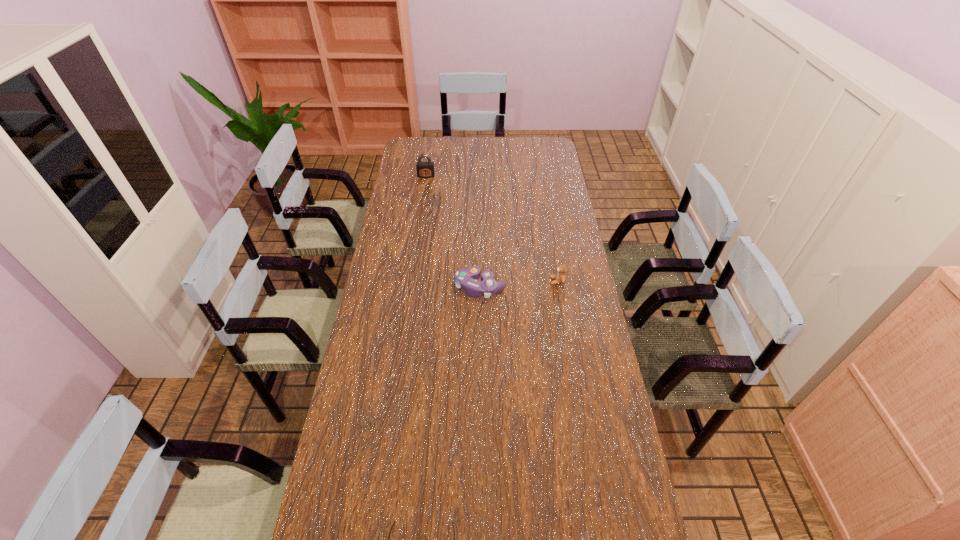
The height and width of the screenshot is (540, 960). What are the coordinates of `object that is at the right edge` in the screenshot? It's located at tap(560, 278).

In the image, there is a desktop. Identify the location of vacant area at the far edge. pos(473,140).

Locate an element on the screen. vacant space at the left edge is located at coordinates (398, 249).

Find the location of a particular element. Image resolution: width=960 pixels, height=540 pixels. vacant space at the right edge of the desktop is located at coordinates (538, 185).

In the image, there is a desktop. What are the coordinates of `vacant space at the far left corner` in the screenshot? It's located at (410, 146).

The image size is (960, 540). What are the coordinates of `vacant area that lies between the control and the rightmost object` in the screenshot? It's located at (518, 285).

I want to click on free area in between the control and the tallest object, so click(453, 232).

Where is `vacant area that lies between the control and the padlock`? The image size is (960, 540). vacant area that lies between the control and the padlock is located at coordinates (453, 232).

Locate an element on the screen. This screenshot has width=960, height=540. vacant area that lies between the control and the padlock is located at coordinates (453, 232).

Image resolution: width=960 pixels, height=540 pixels. Identify the location of free spot between the control and the padlock. (453, 232).